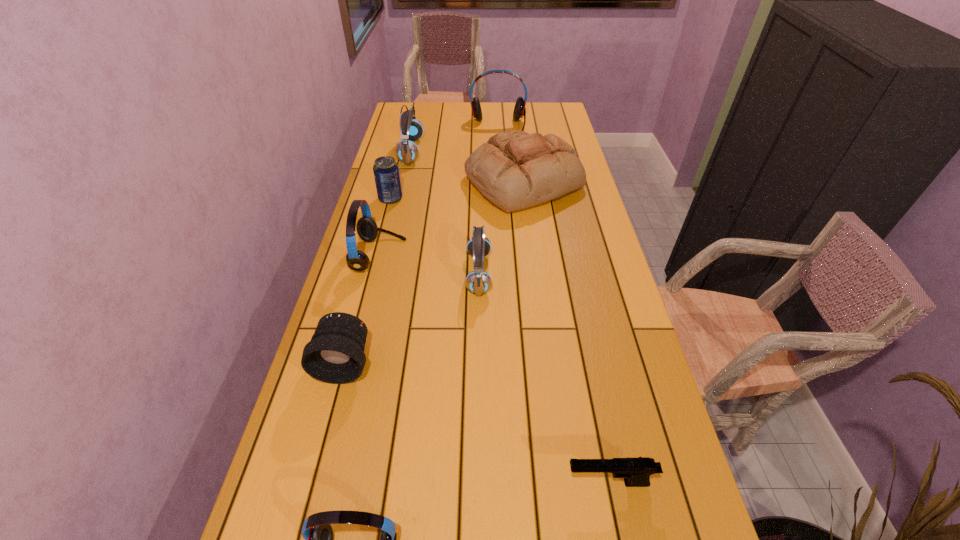
The image size is (960, 540). Find the location of `telephoto lens`. telephoto lens is located at coordinates (335, 354).

Where is `pistol`? Image resolution: width=960 pixels, height=540 pixels. pistol is located at coordinates (636, 471).

Locate an element on the screen. The width and height of the screenshot is (960, 540). the shortest object is located at coordinates (636, 471).

Where is `vacant region located 0.170m with the microphone attached to the side of the farthest headset`? This screenshot has height=540, width=960. vacant region located 0.170m with the microphone attached to the side of the farthest headset is located at coordinates (500, 156).

Where is `vacant space located 0.080m on the ear cups of the bigger blue headset`? The image size is (960, 540). vacant space located 0.080m on the ear cups of the bigger blue headset is located at coordinates (442, 151).

The image size is (960, 540). I want to click on vacant space located on the back of the bread, so [x=516, y=127].

Identify the location of vacant space located with the microphone attached to the side of the second biggest red headset. (535, 256).

This screenshot has height=540, width=960. What are the coordinates of `free space located 0.110m on the front of the soda` in the screenshot? It's located at (384, 225).

Locate an element on the screen. The image size is (960, 540). vacant area situated 0.250m on the ear cups of the smaller blue headset is located at coordinates (577, 274).

Where is `vacant space located 0.280m at the front element of the third nearest object`? The height and width of the screenshot is (540, 960). vacant space located 0.280m at the front element of the third nearest object is located at coordinates (304, 516).